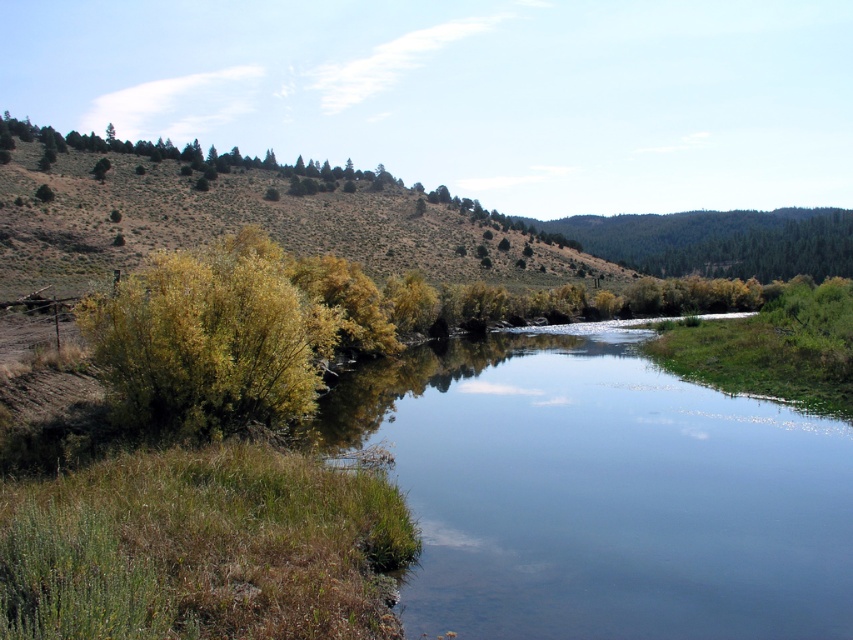
Does green shrubbery at upper left have a larger size compared to green leafy bush at left?

Yes.

Identify the location of green shrubbery at upper left. (242, 220).

This screenshot has width=853, height=640. What are the coordinates of `green shrubbery at upper left` in the screenshot? It's located at (242, 220).

Does point (813, 515) lie in front of point (120, 323)?

Yes, it is.

Where is `clear water at center`? clear water at center is located at coordinates (601, 493).

Where is `clear water at center`? clear water at center is located at coordinates (601, 493).

Does clear water at center appear on the left side of green shrubbery at upper left?

In fact, clear water at center is to the right of green shrubbery at upper left.

In order to click on clear water at center in this screenshot , I will do `click(601, 493)`.